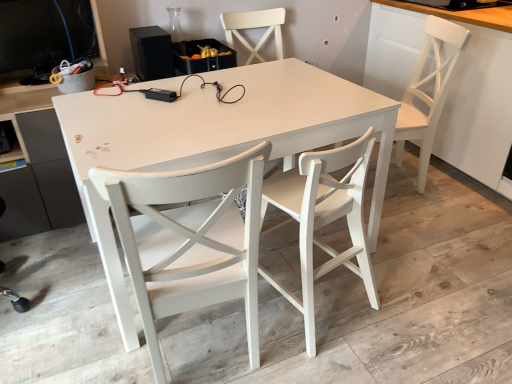
Describe the element at coordinates (216, 138) in the screenshot. I see `white matte table at center` at that location.

Measure the distance between white wood chair at right, the 1th chair from the right, and camera.

They are 2.18 meters apart.

The image size is (512, 384). What are the coordinates of `white painted wood chair at center, which ranks as the 3th chair in right-to-left order` in the screenshot? It's located at (190, 240).

What do you see at coordinates (190, 240) in the screenshot?
I see `white painted wood chair at center, placed as the first chair when sorted from left to right` at bounding box center [190, 240].

Describe the element at coordinates (152, 53) in the screenshot. I see `black matte speaker at upper left` at that location.

Locate an element on the screen. matte black desktop computer at upper left is located at coordinates 44,35.

Can you confirm if white matte table at center is shorter than white wood chair at center, the 2th chair from the left?

Yes, white matte table at center is shorter than white wood chair at center, the 2th chair from the left.

Consider the image. Does white matte table at center have a larger size compared to white wood chair at center, the 2th chair from the left?

Yes.

Is white matte table at center oriented towards white wood chair at center, the second chair positioned from the right?

Yes.

From the image's perspective, would you say white matte table at center is positioned over white wood chair at center, the 2th chair from the left?

Yes, from the image's perspective, white matte table at center is on top of white wood chair at center, the 2th chair from the left.

From the image's perspective, does matte black desktop computer at upper left appear lower than white wood chair at right, positioned as the third chair in left-to-right order?

Incorrect, from the image's perspective, matte black desktop computer at upper left is higher than white wood chair at right, positioned as the third chair in left-to-right order.

Between matte black desktop computer at upper left and white wood chair at right, positioned as the third chair in left-to-right order, which one has more height?

Standing taller between the two is white wood chair at right, positioned as the third chair in left-to-right order.

Between matte black desktop computer at upper left and white wood chair at right, the 1th chair from the right, which one is positioned behind?

white wood chair at right, the 1th chair from the right, is behind.

Could you tell me if matte black desktop computer at upper left is turned towards white wood chair at right, positioned as the third chair in left-to-right order?

No, matte black desktop computer at upper left is not oriented towards white wood chair at right, positioned as the third chair in left-to-right order.

Looking at this image, from the image's perspective, is white painted wood chair at center, which ranks as the 3th chair in right-to-left order, on white wood chair at center, the 2th chair from the left?

Incorrect, from the image's perspective, white painted wood chair at center, which ranks as the 3th chair in right-to-left order, is lower than white wood chair at center, the 2th chair from the left.

How different are the orientations of white painted wood chair at center, placed as the first chair when sorted from left to right, and white wood chair at center, the 2th chair from the left, in degrees?

There is a 20.3-degree angle between the facing directions of white painted wood chair at center, placed as the first chair when sorted from left to right, and white wood chair at center, the 2th chair from the left.

Measure the distance between white painted wood chair at center, placed as the first chair when sorted from left to right, and white wood chair at center, the 2th chair from the left.

white painted wood chair at center, placed as the first chair when sorted from left to right, is 37.95 centimeters from white wood chair at center, the 2th chair from the left.

Is white painted wood chair at center, placed as the first chair when sorted from left to right, not inside white wood chair at center, the second chair positioned from the right?

Indeed, white painted wood chair at center, placed as the first chair when sorted from left to right, is completely outside white wood chair at center, the second chair positioned from the right.

From the image's perspective, is matte black desktop computer at upper left positioned above or below white wood chair at center, the second chair positioned from the right?

matte black desktop computer at upper left is situated higher than white wood chair at center, the second chair positioned from the right, in the image.

Image resolution: width=512 pixels, height=384 pixels. I want to click on desktop computer that is behind the white wood chair at center, the 2th chair from the left, so 44,35.

Is matte black desktop computer at upper left not inside white wood chair at center, the 2th chair from the left?

That's correct, matte black desktop computer at upper left is outside of white wood chair at center, the 2th chair from the left.

How many degrees apart are the facing directions of matte black desktop computer at upper left and white wood chair at center, the 2th chair from the left?

matte black desktop computer at upper left and white wood chair at center, the 2th chair from the left, are facing 180 degrees away from each other.

Is white painted wood chair at center, which ranks as the 3th chair in right-to-left order, situated inside black matte speaker at upper left or outside?

white painted wood chair at center, which ranks as the 3th chair in right-to-left order, is located beyond the bounds of black matte speaker at upper left.

The image size is (512, 384). I want to click on speaker on the left of white painted wood chair at center, placed as the first chair when sorted from left to right, so click(x=152, y=53).

Relative to black matte speaker at upper left, is white painted wood chair at center, placed as the first chair when sorted from left to right, in front or behind?

In the image, white painted wood chair at center, placed as the first chair when sorted from left to right, appears in front of black matte speaker at upper left.

Could you measure the distance between white wood chair at right, the 1th chair from the right, and white matte table at center?

white wood chair at right, the 1th chair from the right, is 37.33 inches from white matte table at center.

How different are the orientations of white wood chair at right, positioned as the third chair in left-to-right order, and white matte table at center in degrees?

The facing directions of white wood chair at right, positioned as the third chair in left-to-right order, and white matte table at center are 110 degrees apart.

Does white wood chair at right, positioned as the third chair in left-to-right order, have a greater height compared to white matte table at center?

Correct, white wood chair at right, positioned as the third chair in left-to-right order, is much taller as white matte table at center.

Considering the sizes of white wood chair at right, positioned as the third chair in left-to-right order, and white matte table at center in the image, is white wood chair at right, positioned as the third chair in left-to-right order, wider or thinner than white matte table at center?

Considering their sizes, white wood chair at right, positioned as the third chair in left-to-right order, looks slimmer than white matte table at center.

Which of these two, black matte speaker at upper left or matte black desktop computer at upper left, is thinner?

With smaller width is matte black desktop computer at upper left.

Measure the distance from black matte speaker at upper left to matte black desktop computer at upper left.

black matte speaker at upper left is 16.66 inches away from matte black desktop computer at upper left.

From a real-world perspective, is black matte speaker at upper left positioned under matte black desktop computer at upper left based on gravity?

Correct, in the physical world, black matte speaker at upper left is lower than matte black desktop computer at upper left.

Can you confirm if black matte speaker at upper left is bigger than matte black desktop computer at upper left?

Incorrect, black matte speaker at upper left is not larger than matte black desktop computer at upper left.

This screenshot has width=512, height=384. I want to click on the 1st chair below the white matte table at center (from the image's perspective), so click(324, 218).

Image resolution: width=512 pixels, height=384 pixels. In order to click on desktop computer above the white wood chair at right, positioned as the third chair in left-to-right order (from a real-world perspective) in this screenshot , I will do `click(44, 35)`.

From the image, which object appears to be farther from white wood chair at right, positioned as the third chair in left-to-right order, black matte speaker at upper left or white painted wood chair at center, placed as the first chair when sorted from left to right?

white painted wood chair at center, placed as the first chair when sorted from left to right.

Based on their spatial positions, is white painted wood chair at center, which ranks as the 3th chair in right-to-left order, or white matte table at center closer to black matte speaker at upper left?

Based on the image, white matte table at center appears to be nearer to black matte speaker at upper left.

Looking at the image, which one is located further to white painted wood chair at center, which ranks as the 3th chair in right-to-left order, black matte speaker at upper left or white matte table at center?

black matte speaker at upper left lies further to white painted wood chair at center, which ranks as the 3th chair in right-to-left order, than the other object.

Looking at this image, considering their positions, is matte black desktop computer at upper left positioned closer to white painted wood chair at center, placed as the first chair when sorted from left to right, than white wood chair at center, the 2th chair from the left?

white wood chair at center, the 2th chair from the left, lies closer to white painted wood chair at center, placed as the first chair when sorted from left to right, than the other object.

When comparing their distances from white wood chair at right, positioned as the third chair in left-to-right order, does matte black desktop computer at upper left or white matte table at center seem further?

matte black desktop computer at upper left lies further to white wood chair at right, positioned as the third chair in left-to-right order, than the other object.

Considering their positions, is black matte speaker at upper left positioned closer to matte black desktop computer at upper left than white painted wood chair at center, which ranks as the 3th chair in right-to-left order?

black matte speaker at upper left is positioned closer to the anchor matte black desktop computer at upper left.

Looking at the image, which one is located further to matte black desktop computer at upper left, black matte speaker at upper left or white wood chair at right, the 1th chair from the right?

Among the two, white wood chair at right, the 1th chair from the right, is located further to matte black desktop computer at upper left.

Estimate the real-world distances between objects in this image. Which object is closer to white painted wood chair at center, which ranks as the 3th chair in right-to-left order, white matte table at center or matte black desktop computer at upper left?

white matte table at center is closer to white painted wood chair at center, which ranks as the 3th chair in right-to-left order.

The image size is (512, 384). Find the location of `speaker situated between matte black desktop computer at upper left and white wood chair at right, the 1th chair from the right, from left to right`. speaker situated between matte black desktop computer at upper left and white wood chair at right, the 1th chair from the right, from left to right is located at coordinates (152, 53).

Identify the location of table between white painted wood chair at center, which ranks as the 3th chair in right-to-left order, and white wood chair at center, the second chair positioned from the right. (216, 138).

What are the coordinates of `table between white painted wood chair at center, placed as the first chair when sorted from left to right, and black matte speaker at upper left in the front-back direction` in the screenshot? It's located at (216, 138).

You are a GUI agent. You are given a task and a screenshot of the screen. Output one action in this format:
    pyautogui.click(x=<x>, y=<y>)
    Task: Click on the desktop computer positioned between white matte table at center and black matte speaker at upper left from near to far
    This screenshot has height=384, width=512.
    Given the screenshot: What is the action you would take?
    pyautogui.click(x=44, y=35)